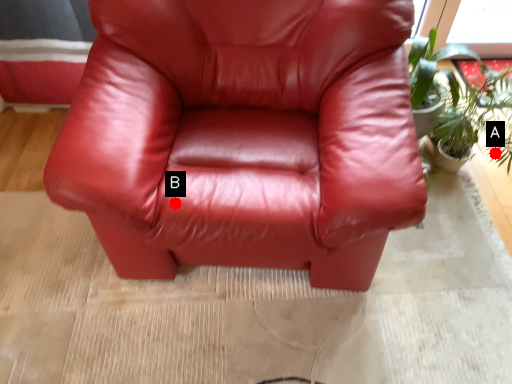
Question: Two points are circled on the image, labeled by A and B beside each circle. Which point is closer to the camera?

Choices:
 (A) A is closer
 (B) B is closer

Answer: (B)